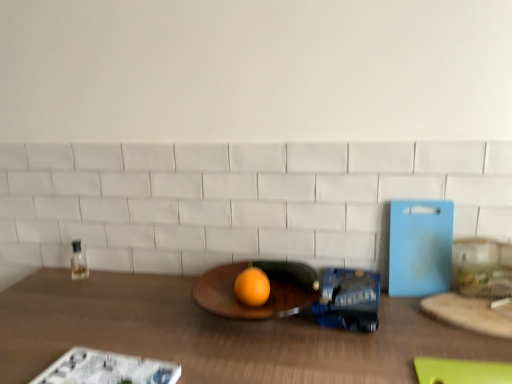
This screenshot has height=384, width=512. Find the location of `empty space that is to the right of clear glass bottle at left`. empty space that is to the right of clear glass bottle at left is located at coordinates (131, 286).